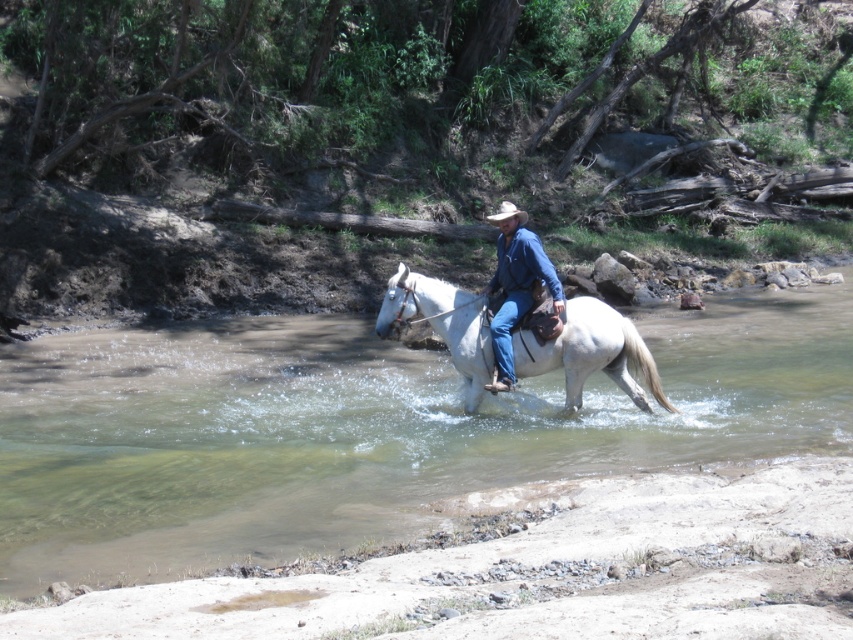
Which is behind, point (180, 380) or point (474, 305)?

The point (180, 380) is behind.

Can you confirm if clear water at horse center is smaller than white glossy horse at center?

No, clear water at horse center is not smaller than white glossy horse at center.

Where is `clear water at horse center`? clear water at horse center is located at coordinates (364, 429).

Image resolution: width=853 pixels, height=640 pixels. Find the location of `clear water at horse center`. clear water at horse center is located at coordinates point(364,429).

Measure the distance between white glossy horse at center and light brown felt cowboy hat at center.

The distance of white glossy horse at center from light brown felt cowboy hat at center is 2.66 meters.

Between white glossy horse at center and light brown felt cowboy hat at center, which one is positioned lower?

Positioned lower is white glossy horse at center.

At what (x,y) coordinates should I click in order to perform the action: click on white glossy horse at center. Please return your answer as a coordinate pair (x, y). Looking at the image, I should click on (590, 353).

Is clear water at horse center further to the viewer compared to blue denim jeans at center?

No, it is in front of blue denim jeans at center.

Who is more forward, (21,385) or (518,218)?

Positioned in front is point (518,218).

You are a GUI agent. You are given a task and a screenshot of the screen. Output one action in this format:
    pyautogui.click(x=<x>, y=<y>)
    Task: Click on the clear water at horse center
    This screenshot has width=853, height=640.
    Given the screenshot: What is the action you would take?
    pyautogui.click(x=364, y=429)

Where is `clear water at horse center`? This screenshot has height=640, width=853. clear water at horse center is located at coordinates (364, 429).